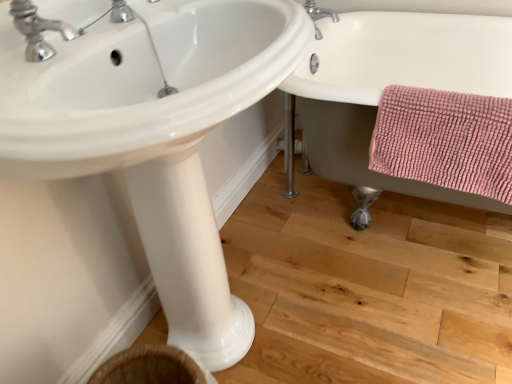
Find the location of `vacant location below white glossy sink at center (from a real-world perspective)`. vacant location below white glossy sink at center (from a real-world perspective) is located at coordinates (260, 320).